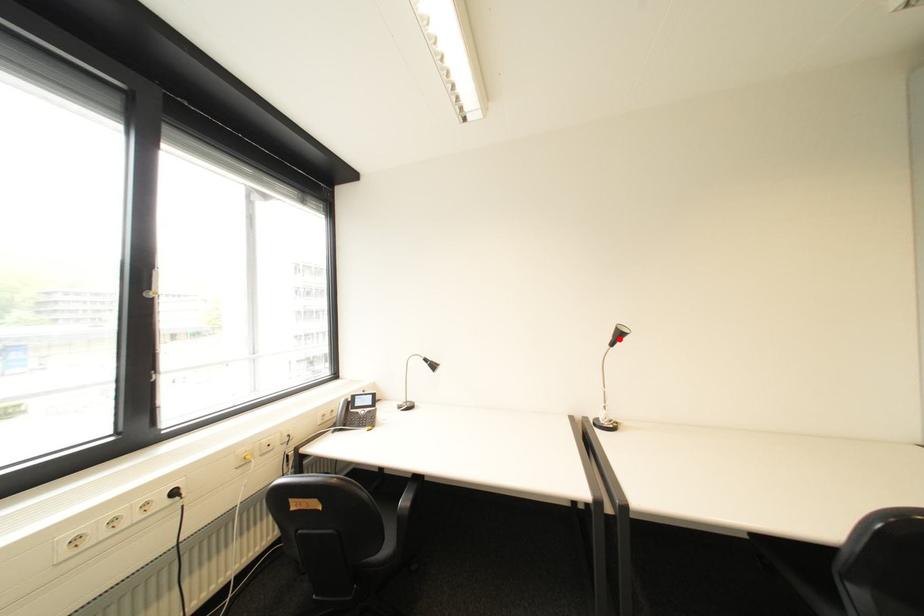
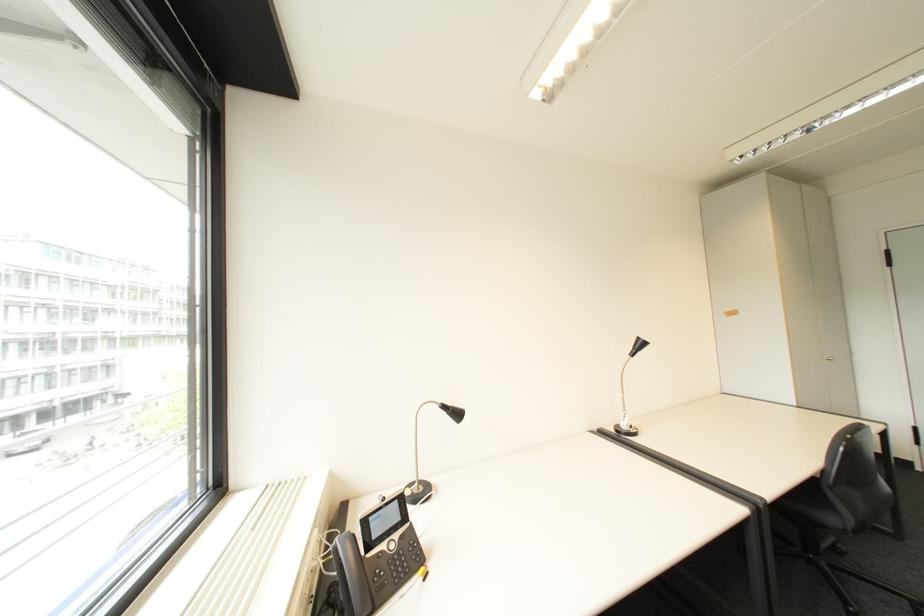
Find the pixel in the second image that matches the highlighted location in the first image.

(640, 350)